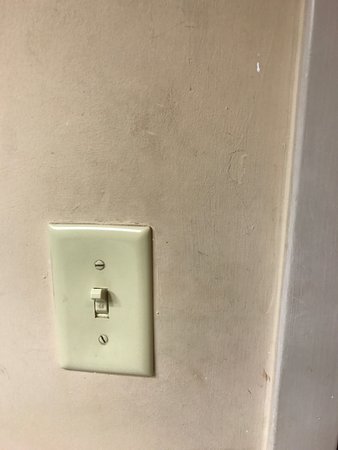
This screenshot has height=450, width=338. In order to click on board in this screenshot , I will do `click(313, 373)`.